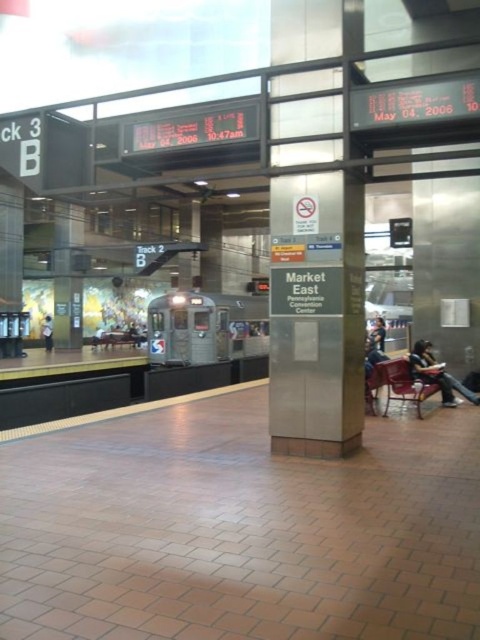
Between point (444, 378) and point (44, 326), which one is positioned behind?

The point (44, 326) is behind.

Can you confirm if dark blue jeans at lower right is positioned to the left of light blue shirt at left?

In fact, dark blue jeans at lower right is to the right of light blue shirt at left.

Between point (422, 371) and point (45, 333), which one is positioned in front?

Point (422, 371)

The image size is (480, 640). Find the location of `dark blue jeans at lower right`. dark blue jeans at lower right is located at coordinates (437, 374).

Can you confirm if satin silver sign at center is taller than silver metallic train at center?

No, satin silver sign at center is not taller than silver metallic train at center.

Does satin silver sign at center lie in front of silver metallic train at center?

Yes, it is in front of silver metallic train at center.

Does point (334, 308) come farther from viewer compared to point (214, 316)?

No, it is in front of (214, 316).

I want to click on satin silver sign at center, so click(x=316, y=314).

In the scene shown: Is satin silver sign at center further to camera compared to dark blue jeans at center?

No, satin silver sign at center is closer to the viewer.

Does satin silver sign at center have a greater width compared to dark blue jeans at center?

In fact, satin silver sign at center might be narrower than dark blue jeans at center.

Describe the element at coordinates (316, 314) in the screenshot. I see `satin silver sign at center` at that location.

Identify the location of satin silver sign at center. (316, 314).